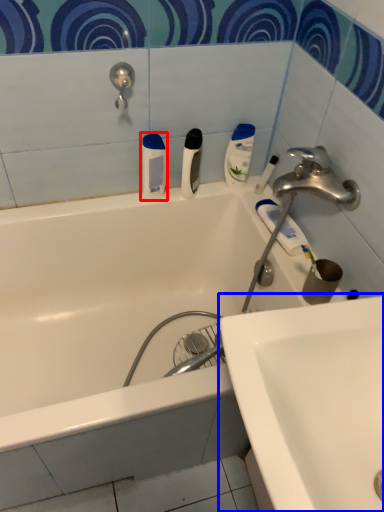
Question: Among these objects, which one is nearest to the camera, toiletry (highlighted by a red box) or sink (highlighted by a blue box)?

Choices:
 (A) toiletry
 (B) sink

Answer: (B)